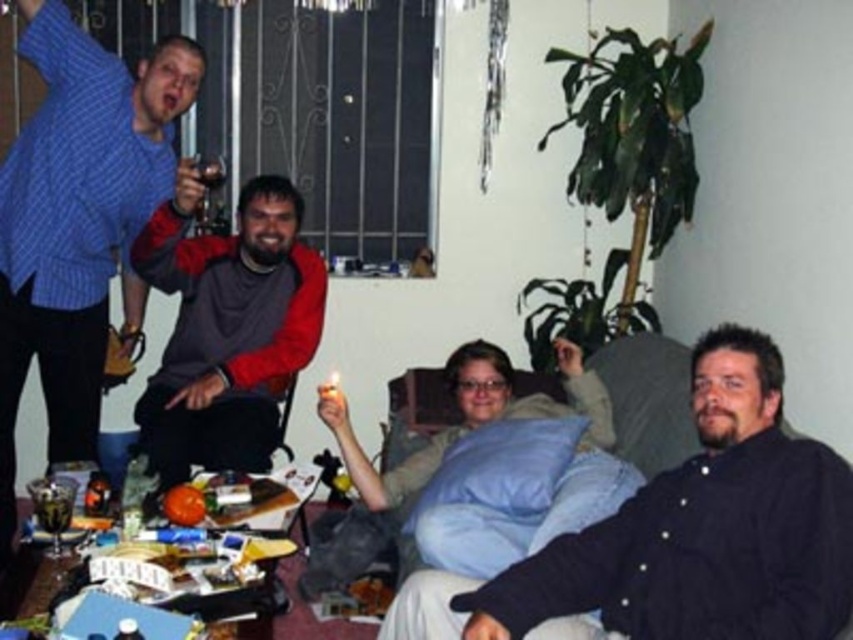
Does black cotton shirt at lower right have a lesser height compared to blue plaid shirt at upper left?

Yes.

Which is more to the left, black cotton shirt at lower right or blue plaid shirt at upper left?

blue plaid shirt at upper left

Does point (788, 436) come farther from viewer compared to point (132, 326)?

That is False.

This screenshot has width=853, height=640. Find the location of `black cotton shirt at lower right`. black cotton shirt at lower right is located at coordinates (682, 536).

Does black cotton shirt at lower right appear over dark gray fleece jacket at center?

No.

Who is lower down, black cotton shirt at lower right or dark gray fleece jacket at center?

black cotton shirt at lower right is lower down.

Is point (691, 634) less distant than point (247, 296)?

That is True.

The width and height of the screenshot is (853, 640). I want to click on black cotton shirt at lower right, so click(x=682, y=536).

Does dark gray fleece jacket at center have a greater width compared to metallic silver can at upper left?

Indeed, dark gray fleece jacket at center has a greater width compared to metallic silver can at upper left.

Which of these two, dark gray fleece jacket at center or metallic silver can at upper left, stands shorter?

With less height is metallic silver can at upper left.

Image resolution: width=853 pixels, height=640 pixels. What do you see at coordinates (225, 326) in the screenshot?
I see `dark gray fleece jacket at center` at bounding box center [225, 326].

You are a GUI agent. You are given a task and a screenshot of the screen. Output one action in this format:
    pyautogui.click(x=<x>, y=<y>)
    Task: Click on the dark gray fleece jacket at center
    The image size is (853, 640).
    Given the screenshot: What is the action you would take?
    pyautogui.click(x=225, y=326)